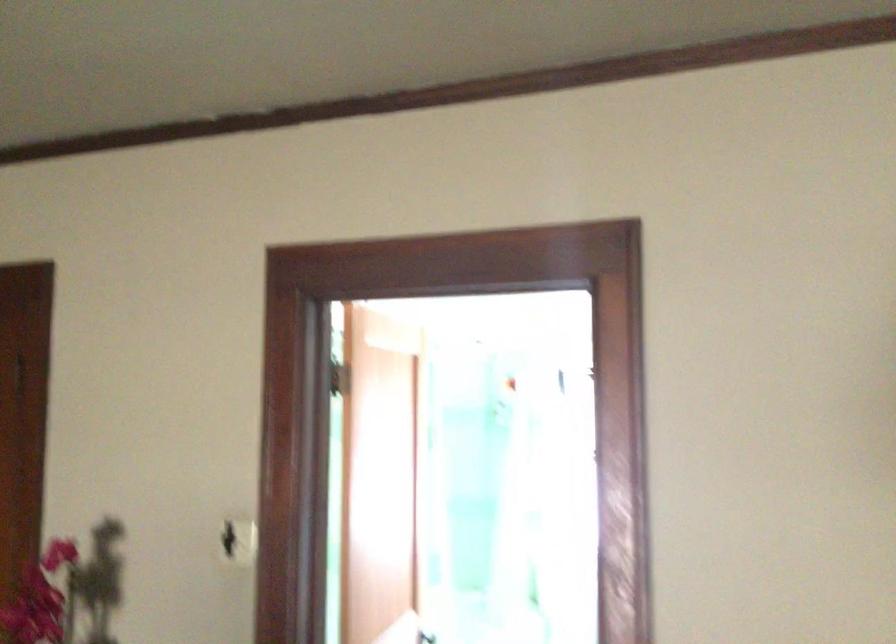
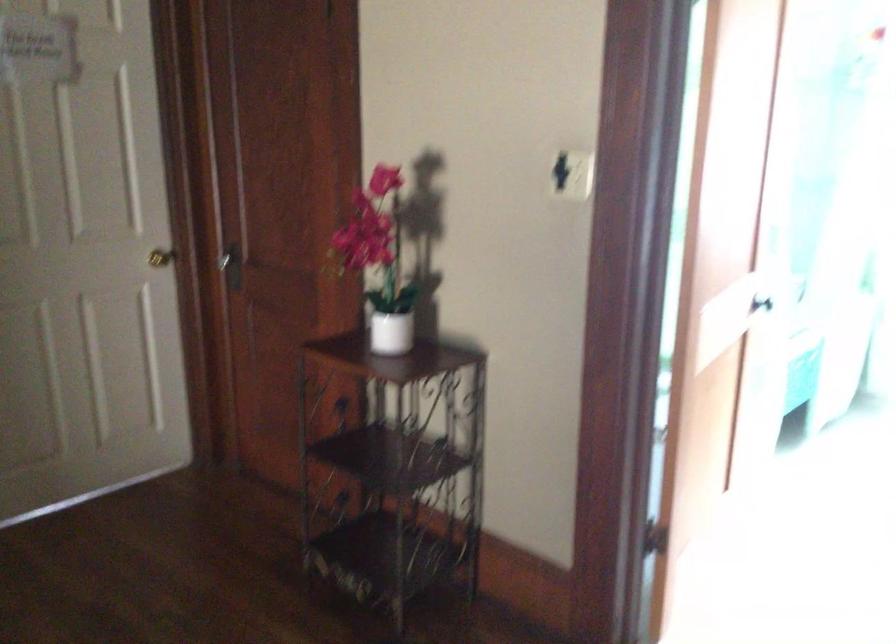
Which direction would the cameraman need to move to produce the second image?

The movement direction of the cameraman is left, forward.